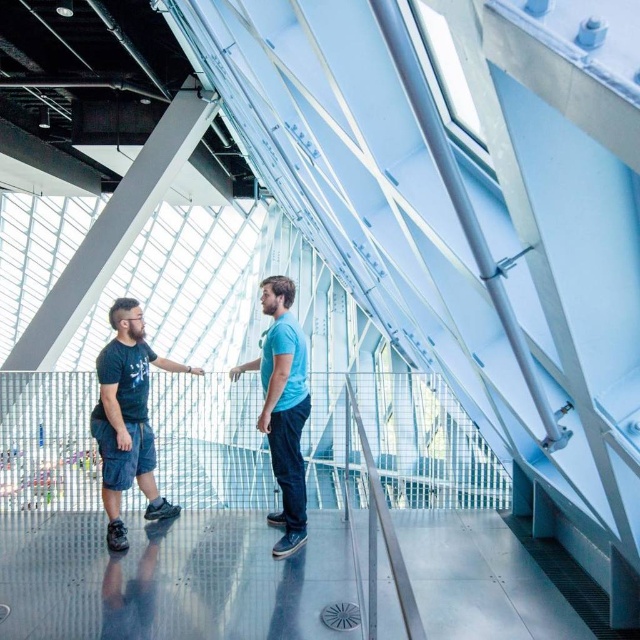
Question: Which point appears closest to the camera in this image?

Choices:
 (A) (125, 362)
 (B) (285, 296)

Answer: (B)

Question: Which of the following is the closest to the observer?

Choices:
 (A) blue cotton t-shirt at center
 (B) dark gray cotton shorts at left

Answer: (A)

Question: Does dark gray cotton shorts at left have a smaller size compared to blue cotton t-shirt at center?

Choices:
 (A) no
 (B) yes

Answer: (B)

Question: Is dark gray cotton shorts at left thinner than blue cotton t-shirt at center?

Choices:
 (A) no
 (B) yes

Answer: (A)

Question: Does dark gray cotton shorts at left appear under blue cotton t-shirt at center?

Choices:
 (A) no
 (B) yes

Answer: (B)

Question: Which point appears closest to the camera in this image?

Choices:
 (A) (300, 337)
 (B) (116, 388)

Answer: (A)